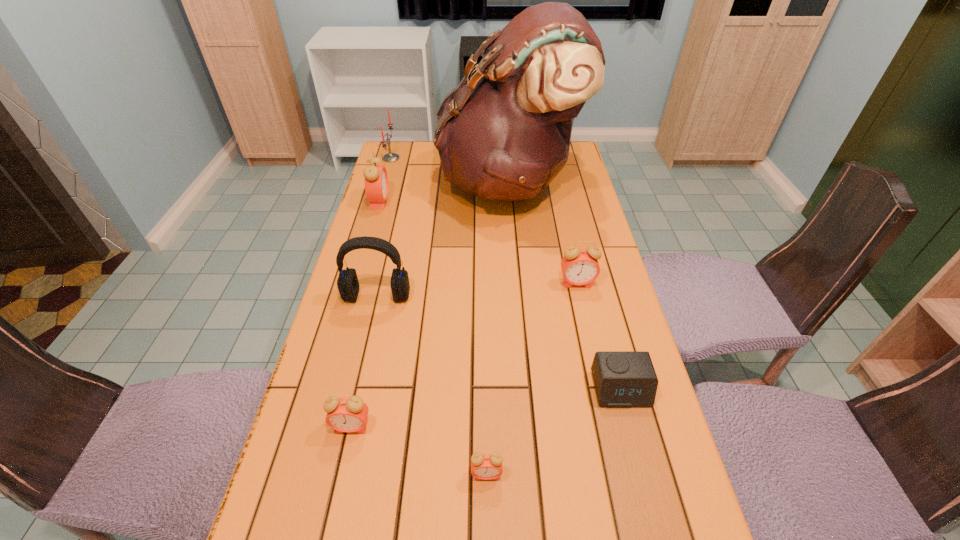
The image size is (960, 540). I want to click on the second pink alarm clock from right to left, so click(x=486, y=466).

Locate an element on the screen. black alarm clock is located at coordinates (623, 379).

Where is `the sixth farthest object`? the sixth farthest object is located at coordinates (623, 379).

Identify the location of free space located 0.060m at the front of the satchel with buckles. The image size is (960, 540). (421, 182).

Where is `vacant space located at the front of the satchel with buckles`? vacant space located at the front of the satchel with buckles is located at coordinates (395, 182).

I want to click on free space located at the front of the satchel with buckles, so click(405, 182).

I want to click on vacant space located on the headband of the headset, so click(370, 328).

I want to click on vacant space located on the face of the tallest alarm clock, so [484, 201].

This screenshot has width=960, height=540. Find the location of `vacant space located on the front-facing side of the candle`. vacant space located on the front-facing side of the candle is located at coordinates (445, 158).

The image size is (960, 540). I want to click on vacant position located on the face of the fourth shortest object, so click(609, 424).